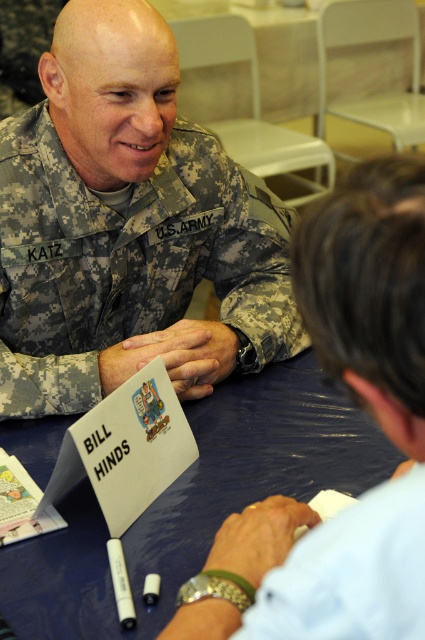
Question: Is the position of camouflage fabric us army uniform at center less distant than that of blue fabric table at center?

Choices:
 (A) no
 (B) yes

Answer: (A)

Question: Among these objects, which one is nearest to the camera?

Choices:
 (A) blue fabric table at center
 (B) camouflage fabric us army uniform at center

Answer: (A)

Question: Can you confirm if camouflage fabric us army uniform at center is thinner than blue fabric table at center?

Choices:
 (A) no
 (B) yes

Answer: (B)

Question: Is camouflage fabric us army uniform at center below blue fabric table at center?

Choices:
 (A) no
 (B) yes

Answer: (A)